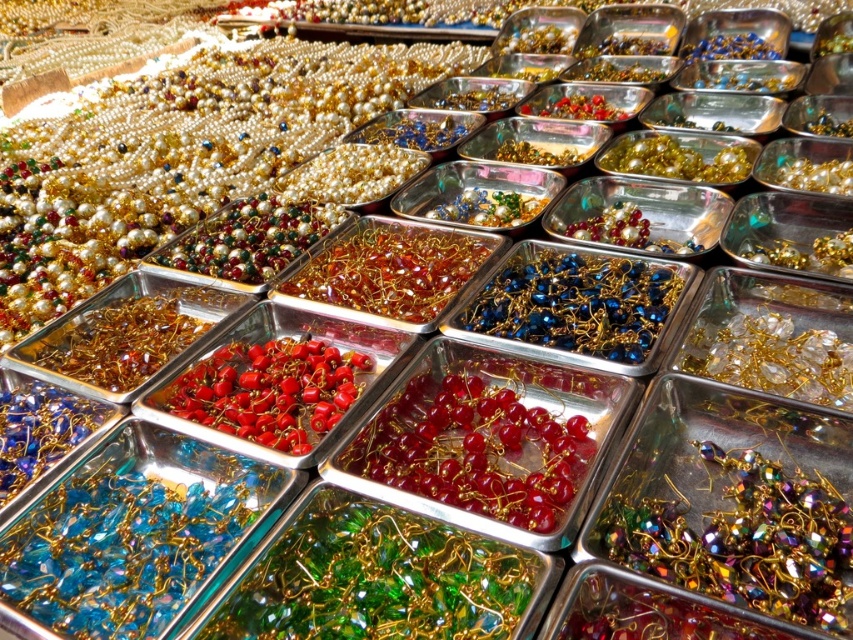
Question: Can you confirm if multicolored glass beads at center is positioned below glossy red beads at center?

Choices:
 (A) yes
 (B) no

Answer: (A)

Question: Where is glossy red beads at center located in relation to blue metallic beads at center in the image?

Choices:
 (A) left
 (B) right

Answer: (A)

Question: Considering the real-world distances, which object is farthest from the translucent amber beads at center?

Choices:
 (A) blue metallic beads at center
 (B) multicolored glass beads at center
 (C) translucent red beads at center
 (D) glossy red beads at center

Answer: (B)

Question: Can you confirm if multicolored glass beads at center is positioned to the right of glossy red beads at center?

Choices:
 (A) no
 (B) yes

Answer: (B)

Question: Among these objects, which one is farthest from the camera?

Choices:
 (A) multicolored glass beads at center
 (B) translucent red beads at center

Answer: (B)

Question: Which point is closer to the camera taking this photo?

Choices:
 (A) (483, 444)
 (B) (312, 369)
 (C) (329, 289)

Answer: (A)